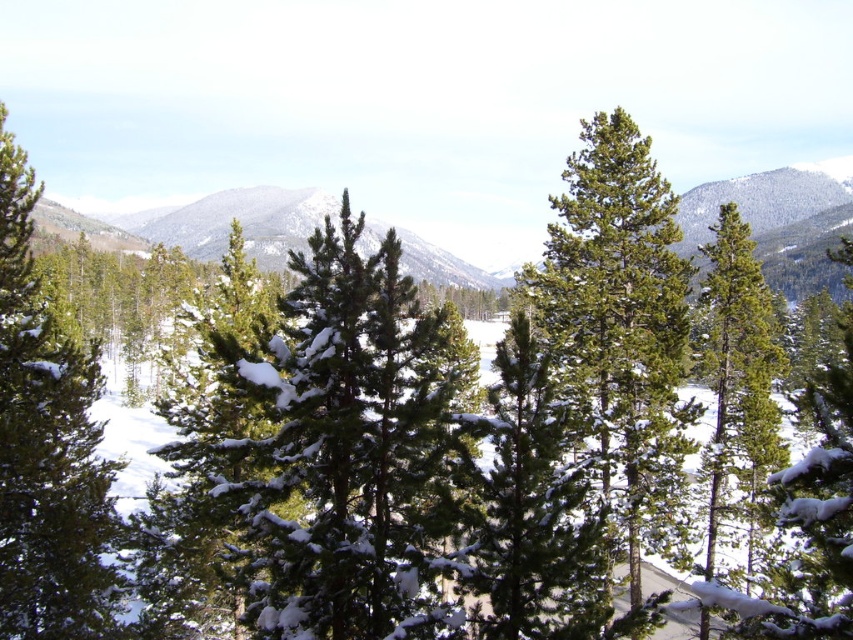
You are a hiker who wants to cross between the green matte tree at left and the green matte tree at right. The path between them is 65.56 feet wide. If your hiking gear allows you to carry a maximum load of 50 pounds, can you safely cross the gap?

The path between the green matte tree at left and the green matte tree at right is 65.56 feet wide. Since the gap is wider than typical safe crossing distances for a hiker with a 50 pound load, it would not be safe to attempt crossing.

You are an environmental scientist assessing the forest health. You observe the green matte tree at left and the green matte tree at right. Which tree shows signs of better growth based on their height?

The green matte tree at left has a greater height compared to the green matte tree at right, indicating better growth.

You are standing in the middle of the winter forest and see the green matte tree at left and the green matte tree at right. Which tree is closer to your left side?

The green matte tree at left is closer to your left side because it is positioned to the left of the green matte tree at right.